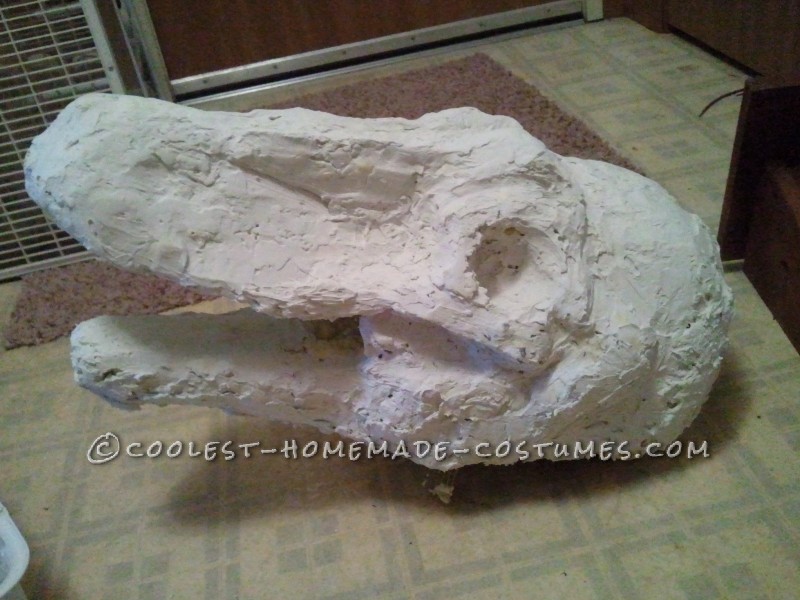
The width and height of the screenshot is (800, 600). What are the coordinates of `boxfan` in the screenshot? It's located at (49, 54).